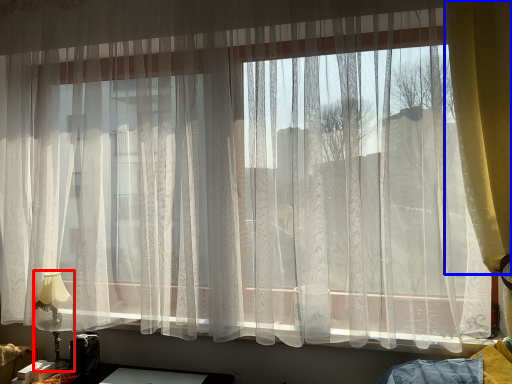
Question: Which object appears closest to the camera in this image, table lamp (highlighted by a red box) or curtain (highlighted by a blue box)?

Choices:
 (A) table lamp
 (B) curtain

Answer: (B)